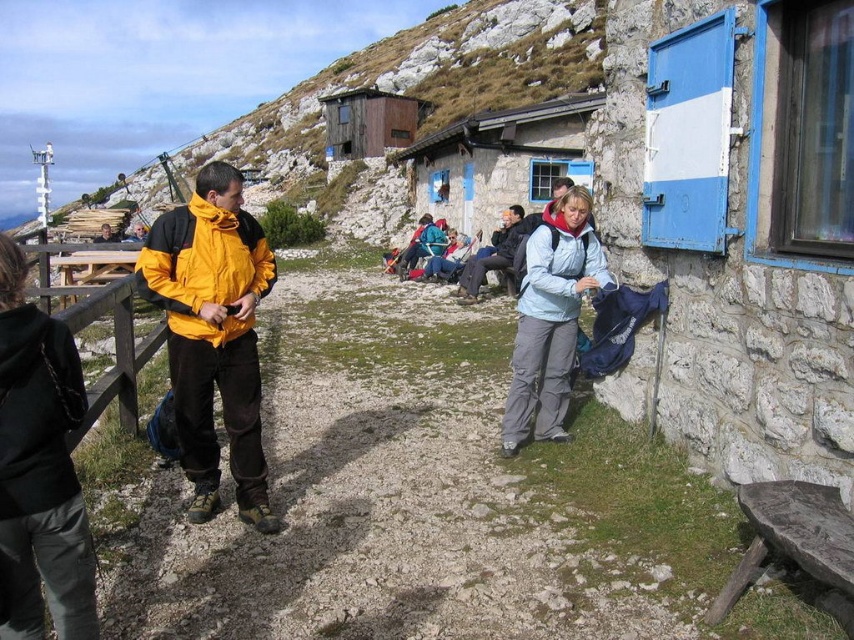
Question: Which of these objects is positioned farthest from the stone cabin at center?

Choices:
 (A) black leather jacket at left
 (B) light blue fabric jacket at lower center
 (C) rustic wood cabin at center
 (D) yellow matte jacket at left

Answer: (A)

Question: Is black leather jacket at left to the right of wooden at left from the viewer's perspective?

Choices:
 (A) yes
 (B) no

Answer: (A)

Question: Among these objects, which one is farthest from the camera?

Choices:
 (A) yellow matte jacket at left
 (B) brushed metal hut at upper center

Answer: (B)

Question: Is yellow matte jacket at left behind light blue jacket at center?

Choices:
 (A) yes
 (B) no

Answer: (B)

Question: Considering the relative positions of black leather jacket at left and rustic wood cabin at center in the image provided, where is black leather jacket at left located with respect to rustic wood cabin at center?

Choices:
 (A) right
 (B) left

Answer: (A)

Question: Which object is the closest to the black leather jacket at left?

Choices:
 (A) light blue fabric jacket at lower center
 (B) wooden at left
 (C) rustic wood cabin at center
 (D) yellow matte jacket at left

Answer: (D)